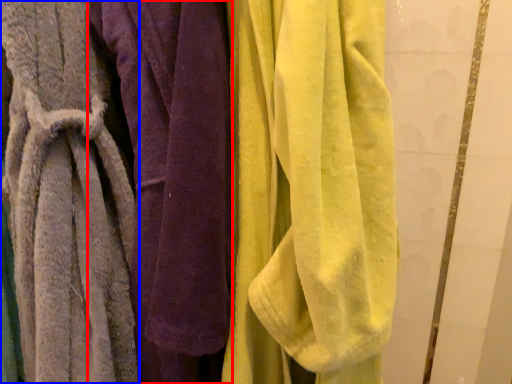
Question: Which object is closer to the camera taking this photo, towel (highlighted by a red box) or towel (highlighted by a blue box)?

Choices:
 (A) towel
 (B) towel

Answer: (B)